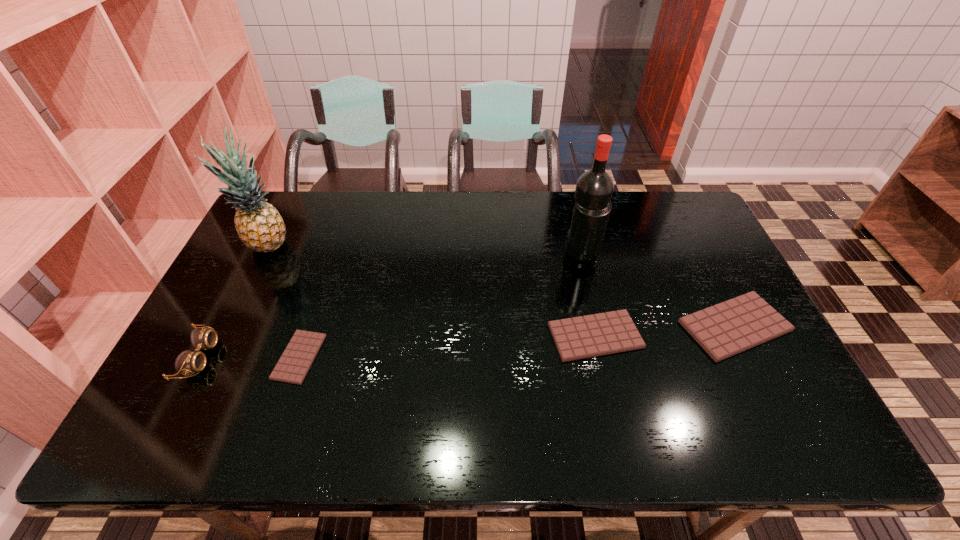
Please mark a free spot for a new chocolate_bar to balance the arrangement. Please provide its 2D coordinates. Your answer should be formatted as a tuple, i.e. [(x, y)], where the tuple contains the x and y coordinates of a point satisfying the conditions above.

[(450, 346)]